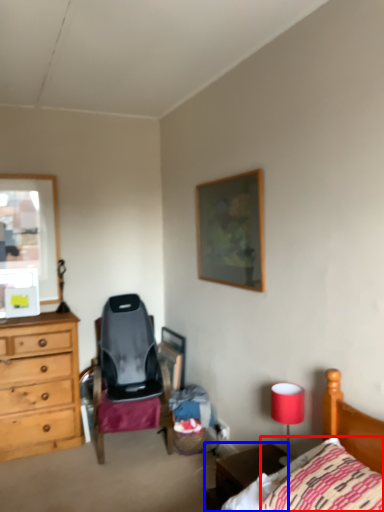
Question: Which point is closer to the camera, pillow (highlighted by a red box) or nightstand (highlighted by a blue box)?

Choices:
 (A) pillow
 (B) nightstand

Answer: (A)